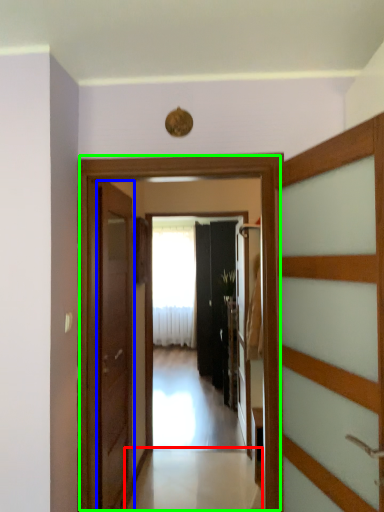
Question: Considering the real-world distances, which object is closest to path (highlighted by a red box)? door (highlighted by a blue box) or elevator (highlighted by a green box).

Choices:
 (A) door
 (B) elevator

Answer: (A)